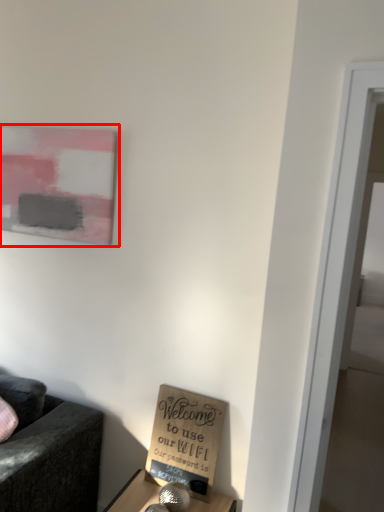
Question: In this image, where is picture frame (annotated by the red box) located relative to cardboard box?

Choices:
 (A) left
 (B) right

Answer: (A)